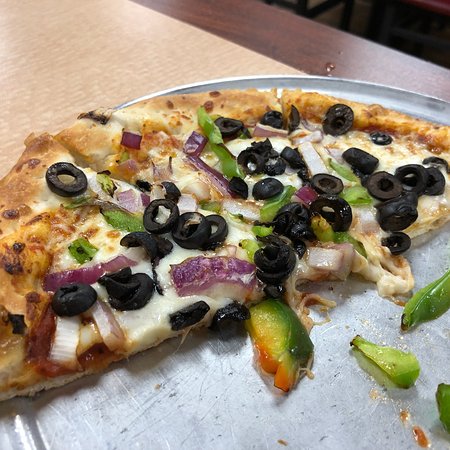
Locate an element on the screen. This screenshot has width=450, height=450. floor is located at coordinates (414, 39).